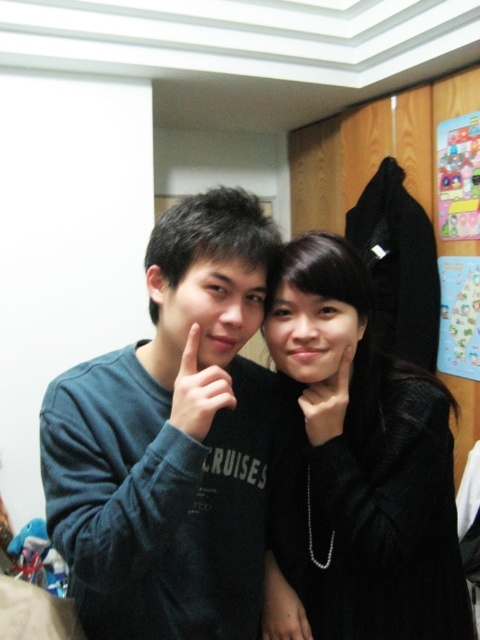
Based on the photo, is dark blue sweatshirt at center to the right of black matte coat at center from the viewer's perspective?

No, dark blue sweatshirt at center is not to the right of black matte coat at center.

Which is behind, point (87, 493) or point (365, 508)?

Positioned behind is point (365, 508).

The image size is (480, 640). Find the location of `dark blue sweatshirt at center`. dark blue sweatshirt at center is located at coordinates [179, 448].

Between point (217, 394) and point (302, 408), which one is positioned in front?

Point (217, 394) is more forward.

This screenshot has width=480, height=640. What do you see at coordinates (199, 390) in the screenshot? I see `matte black hand at center` at bounding box center [199, 390].

Where is `matte black hand at center`? The height and width of the screenshot is (640, 480). matte black hand at center is located at coordinates (199, 390).

Which is more to the right, dark blue sweatshirt at center or black matte hand at center?

Positioned to the right is black matte hand at center.

Is point (171, 500) positioned in front of point (339, 410)?

Yes, point (171, 500) is closer to viewer.

At what (x,y) coordinates should I click in order to perform the action: click on dark blue sweatshirt at center. Please return your answer as a coordinate pair (x, y). Looking at the image, I should click on (179, 448).